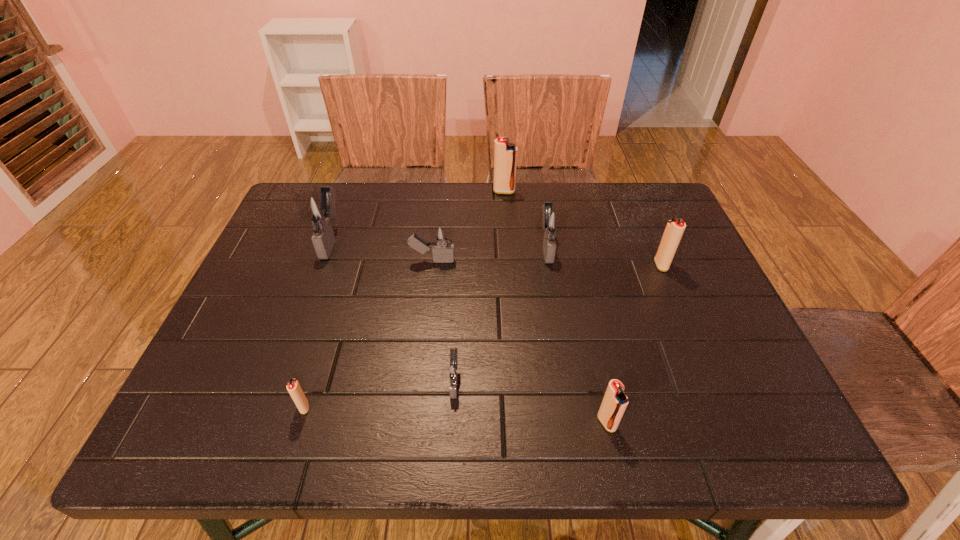
Identify which object is located as the seventh nearest to the third smallest gray igniter. Please provide its 2D coordinates. Your answer should be formatted as a tuple, i.e. [(x, y)], where the tuple contains the x and y coordinates of a point satisfying the conditions above.

[(293, 387)]

Identify the location of object that stands as the closest to the third smallest gray igniter. (505, 154).

The height and width of the screenshot is (540, 960). Find the location of `igniter that is the closest to the leftmost object`. igniter that is the closest to the leftmost object is located at coordinates (443, 252).

Locate an element on the screen. The width and height of the screenshot is (960, 540). igniter that is the sixth nearest to the biggest red igniter is located at coordinates (613, 406).

Identify which red igniter is the fourth closest to the leftmost igniter. Please provide its 2D coordinates. Your answer should be formatted as a tuple, i.e. [(x, y)], where the tuple contains the x and y coordinates of a point satisfying the conditions above.

[(674, 230)]

At what (x,y) coordinates should I click in order to perform the action: click on the second closest red igniter to the second red igniter from left to right. Please return your answer as a coordinate pair (x, y). Looking at the image, I should click on (613, 406).

At what (x,y) coordinates should I click in order to perform the action: click on the closest gray igniter to the rightmost gray igniter. Please return your answer as a coordinate pair (x, y). This screenshot has width=960, height=540. Looking at the image, I should click on (443, 252).

Identify the location of gray igniter that is the second closest to the sixth object from left to right. (453, 370).

Find the location of a particular element. This screenshot has width=960, height=540. blank space that satisfies the following two spatial constraints: 1. on the back side of the smallest gray igniter; 2. on the right side of the rightmost object is located at coordinates (460, 265).